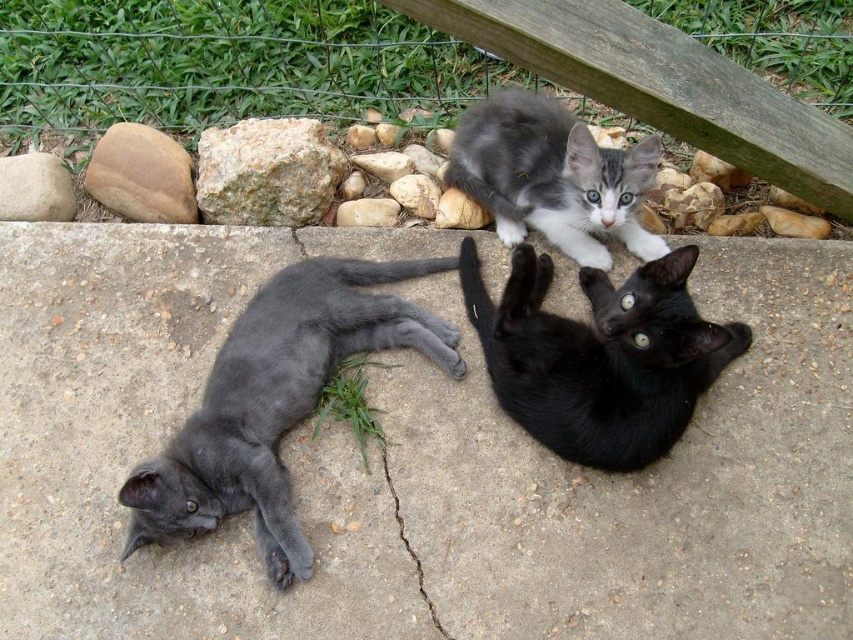
Question: Which point appears closest to the camera in this image?

Choices:
 (A) (399, 211)
 (B) (538, 301)
 (C) (122, 557)

Answer: (C)

Question: Which object is closer to the camera taking this photo?

Choices:
 (A) speckled beige rock at upper left
 (B) smooth gray rock at upper left
 (C) gray fur kitten at center

Answer: (C)

Question: Observing the image, what is the correct spatial positioning of speckled beige rock at upper left in reference to smooth gray rock at center?

Choices:
 (A) below
 (B) above

Answer: (B)

Question: Observing the image, what is the correct spatial positioning of black glossy cat at center in reference to smooth brown rock at left?

Choices:
 (A) left
 (B) right

Answer: (B)

Question: Does smooth gray cat at lower left appear on the right side of smooth gray rock at center?

Choices:
 (A) yes
 (B) no

Answer: (B)

Question: Which object is positioned farthest from the smooth gray rock at upper left?

Choices:
 (A) smooth brown rock at left
 (B) gray fur kitten at center

Answer: (B)